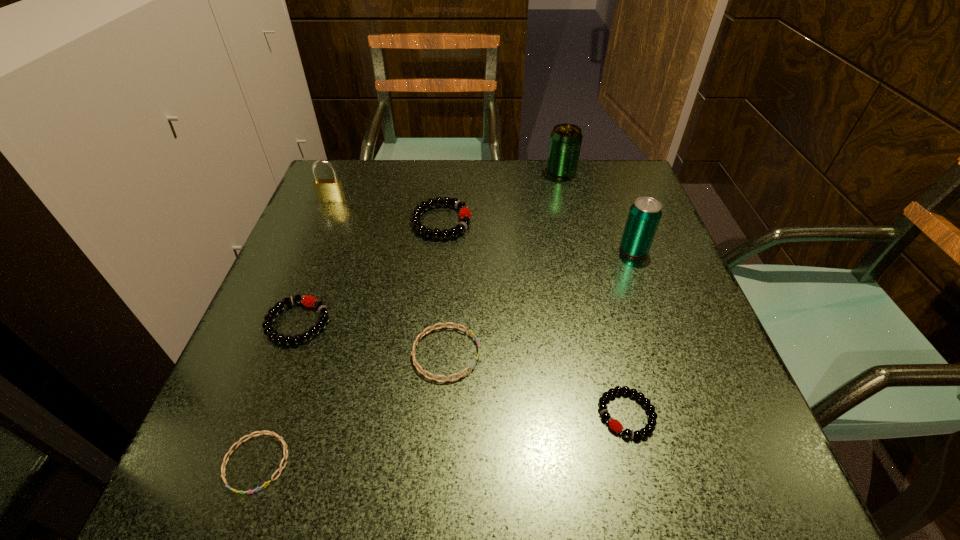
Identify the location of vacant space situated 0.180m on the front of the second smallest black bracelet. (252, 448).

Find the location of a particular element. The image size is (960, 540). blank area located on the surface of the bigger blue bracelet showing star-shaped elements is located at coordinates (549, 354).

At what (x,y) coordinates should I click in order to perform the action: click on vacant position located 0.370m on the left of the rightmost bracelet. Please return your answer as a coordinate pair (x, y). This screenshot has width=960, height=540. Looking at the image, I should click on (362, 414).

Locate an element on the screen. This screenshot has width=960, height=540. beer can present at the far edge is located at coordinates (565, 143).

Where is `padlock that is at the far edge`? Image resolution: width=960 pixels, height=540 pixels. padlock that is at the far edge is located at coordinates (327, 190).

You are a GUI agent. You are given a task and a screenshot of the screen. Output one action in this format:
    pyautogui.click(x=<x>, y=<y>)
    Task: Click on the bracelet situated at the far edge
    This screenshot has width=960, height=540.
    Given the screenshot: What is the action you would take?
    pyautogui.click(x=464, y=213)

Identify the location of padlock situated at the left edge. coord(327,190).

Find the location of a particular element. bracelet located at the right edge is located at coordinates (614, 424).

Image resolution: width=960 pixels, height=540 pixels. What are the coordinates of `object present at the far left corner` in the screenshot? It's located at (327, 190).

Where is `object present at the near left corner`? The height and width of the screenshot is (540, 960). object present at the near left corner is located at coordinates (249, 436).